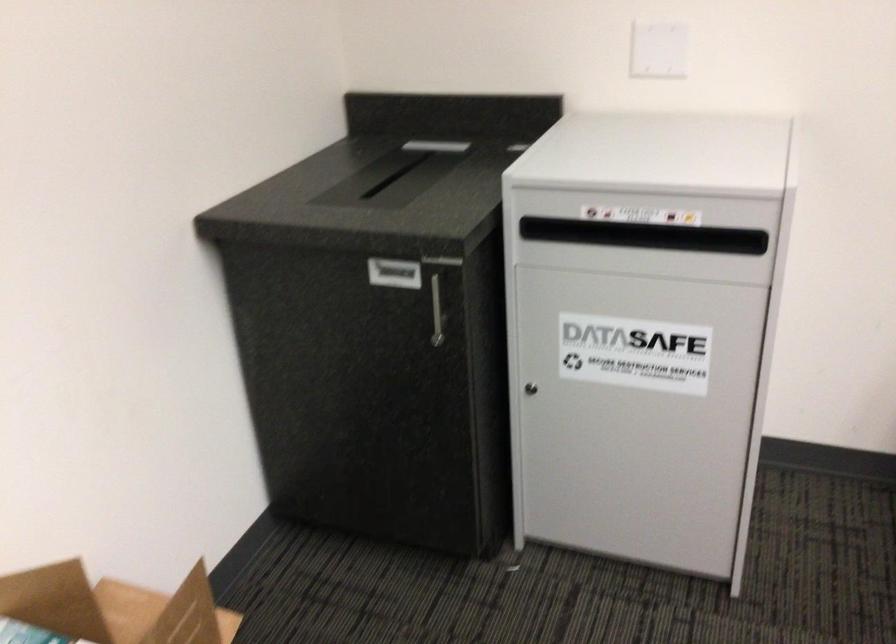
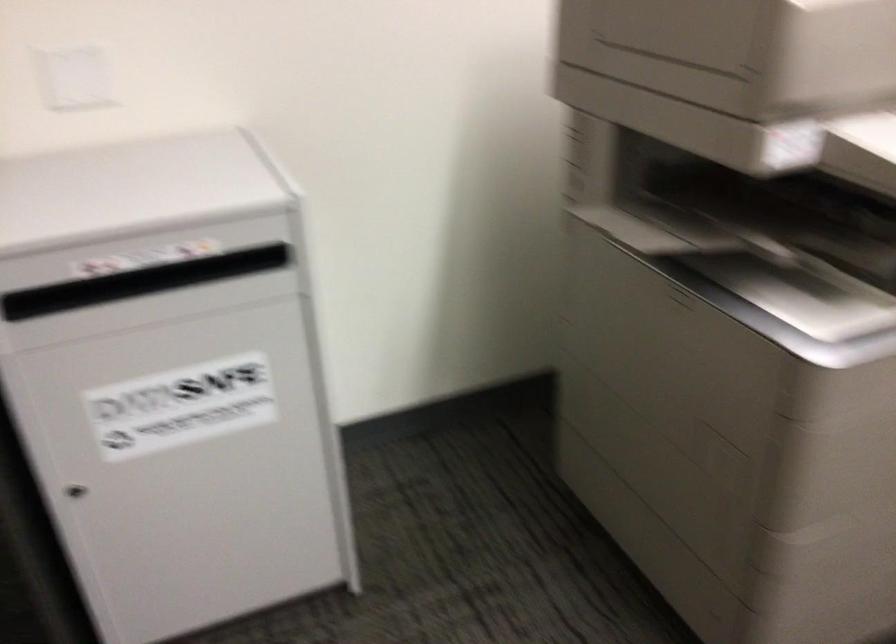
Question: The camera is either moving clockwise (left) or counter-clockwise (right) around the object. The first image is from the beginning of the video and the second image is from the end. Is the camera moving left or right when shooting the video?

Choices:
 (A) Left
 (B) Right

Answer: (A)